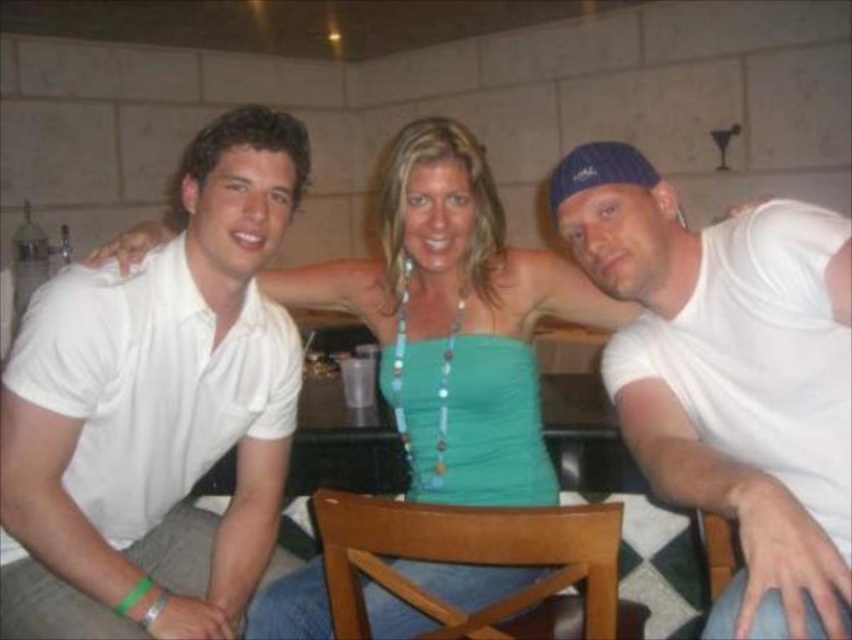
Does white matte tank top at right have a lesser height compared to brown wooden chair at center?

No.

Who is more distant from viewer, (699, 276) or (327, 504)?

Point (699, 276)

Image resolution: width=852 pixels, height=640 pixels. Identify the location of white matte tank top at right. (714, 365).

Does point (435, 172) come farther from viewer compared to point (557, 579)?

Yes, point (435, 172) is farther from viewer.

Based on the photo, who is more distant from viewer, (468, 170) or (335, 506)?

The point (468, 170) is behind.

Between point (467, 141) and point (501, 524), which one is positioned in front?

Point (501, 524)

At what (x,y) coordinates should I click in order to perform the action: click on teal fabric top at center. Please return your answer as a coordinate pair (x, y). Image resolution: width=852 pixels, height=640 pixels. Looking at the image, I should click on (456, 314).

Looking at this image, does white cotton polo shirt at left appear on the left side of wooden chair at center?

Yes, white cotton polo shirt at left is to the left of wooden chair at center.

Which is more to the left, white cotton polo shirt at left or wooden chair at center?

Positioned to the left is white cotton polo shirt at left.

At what (x,y) coordinates should I click in order to perform the action: click on white cotton polo shirt at left. Please return your answer as a coordinate pair (x, y). Image resolution: width=852 pixels, height=640 pixels. Looking at the image, I should click on (154, 410).

Where is `white cotton polo shirt at left`? The height and width of the screenshot is (640, 852). white cotton polo shirt at left is located at coordinates (154, 410).